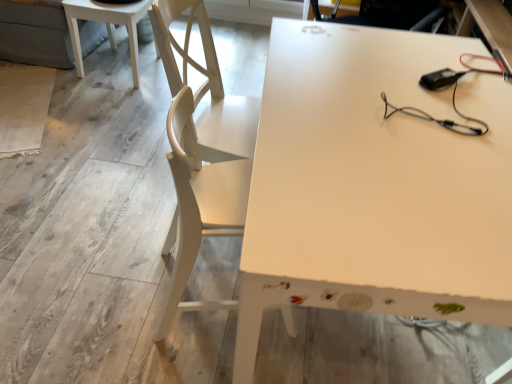
Question: Is white wood chair at left not inside white matte table at center, the 1th table ordered from the bottom?

Choices:
 (A) no
 (B) yes

Answer: (A)

Question: Does white wood chair at left touch white matte table at center, which is counted as the second table, starting from the left?

Choices:
 (A) no
 (B) yes

Answer: (A)

Question: Is white wood chair at left to the left of white matte table at center, the 1th table viewed from the right, from the viewer's perspective?

Choices:
 (A) no
 (B) yes

Answer: (B)

Question: Is white matte table at center, which is counted as the second table, starting from the left, surrounded by white wood chair at left?

Choices:
 (A) no
 (B) yes

Answer: (A)

Question: Are white wood chair at left and white matte table at center, which is counted as the second table, starting from the left, located far from each other?

Choices:
 (A) yes
 (B) no

Answer: (B)

Question: Can you confirm if white wood chair at left is shorter than white matte table at center, which is the second table from back to front?

Choices:
 (A) no
 (B) yes

Answer: (A)

Question: Can you confirm if white matte table at center, which is counted as the second table, starting from the left, is positioned to the right of white glossy table at upper left, the second table in the bottom-to-top sequence?

Choices:
 (A) yes
 (B) no

Answer: (A)

Question: From the image's perspective, does white matte table at center, which is counted as the second table, starting from the left, appear higher than white glossy table at upper left, placed as the second table when sorted from front to back?

Choices:
 (A) no
 (B) yes

Answer: (A)

Question: From the image's perspective, is white matte table at center, which is the second table from back to front, below white glossy table at upper left, the second table in the bottom-to-top sequence?

Choices:
 (A) yes
 (B) no

Answer: (A)

Question: Is white matte table at center, the 1th table ordered from the bottom, aimed at white glossy table at upper left, the second table in the bottom-to-top sequence?

Choices:
 (A) no
 (B) yes

Answer: (A)

Question: Can you confirm if white matte table at center, the 1th table viewed from the right, is shorter than white glossy table at upper left, the second table in the bottom-to-top sequence?

Choices:
 (A) no
 (B) yes

Answer: (A)

Question: Is white matte table at center, the 1th table viewed from the right, smaller than white glossy table at upper left, placed as the second table when sorted from front to back?

Choices:
 (A) no
 (B) yes

Answer: (A)

Question: From the image's perspective, is white glossy table at upper left, the first table positioned from the left, under white matte table at center, the 1th table positioned from the front?

Choices:
 (A) no
 (B) yes

Answer: (A)